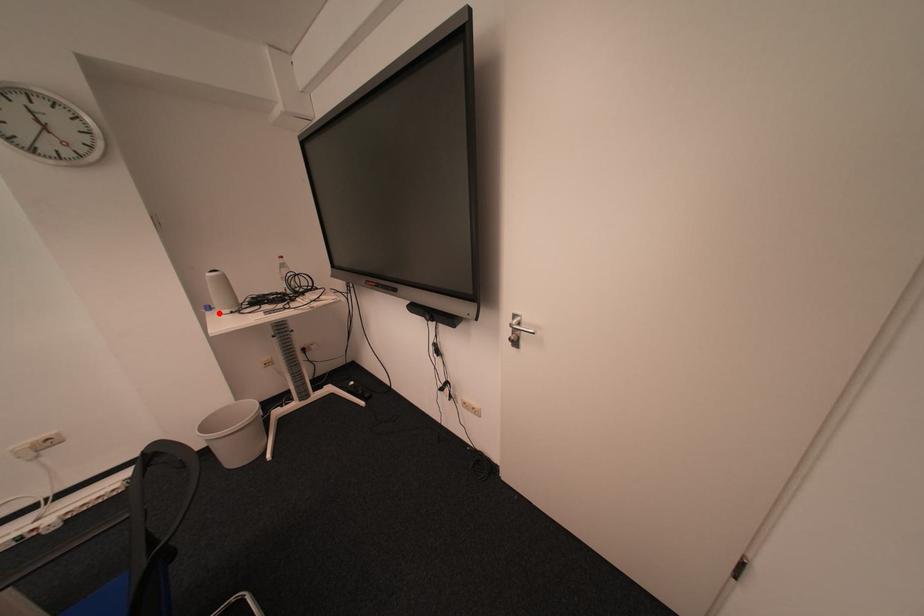
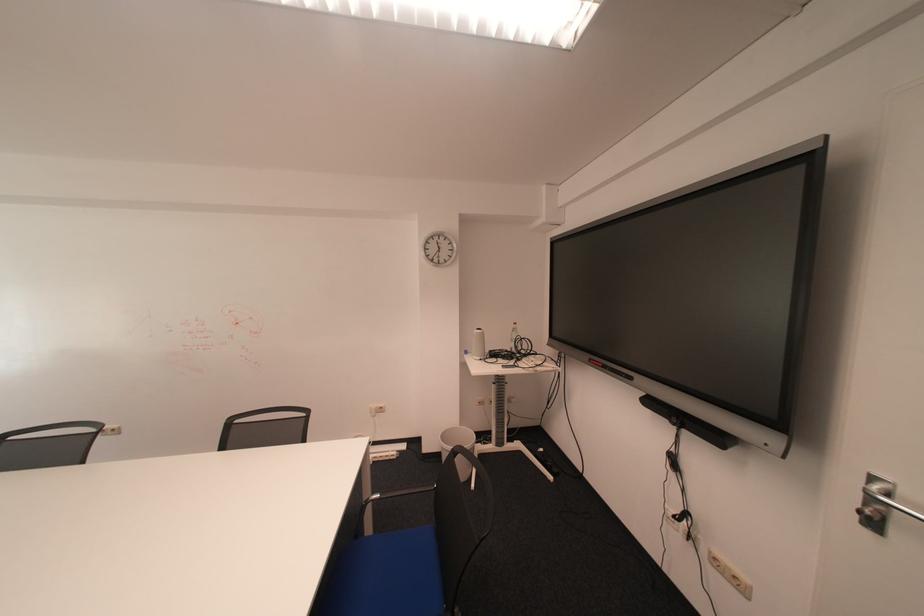
In the second image, find the point that corresponds to the highlighted location in the first image.

(477, 355)